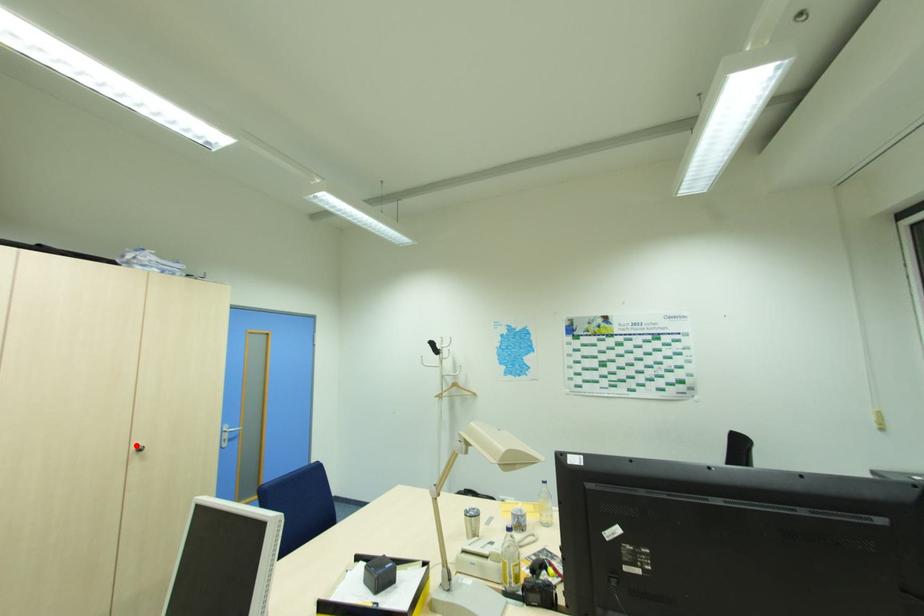
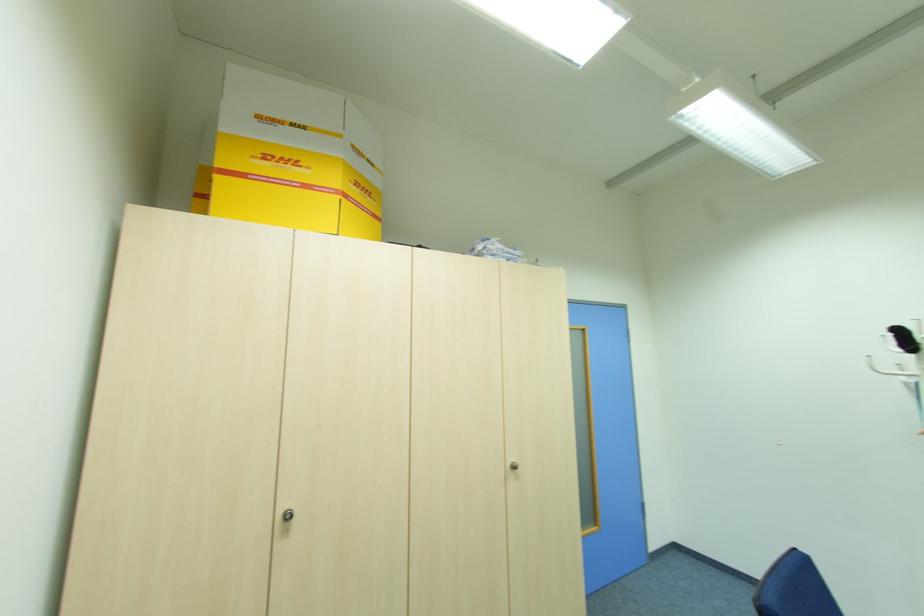
Locate, in the second image, the point that corresponds to the highlighted location in the first image.

(513, 460)